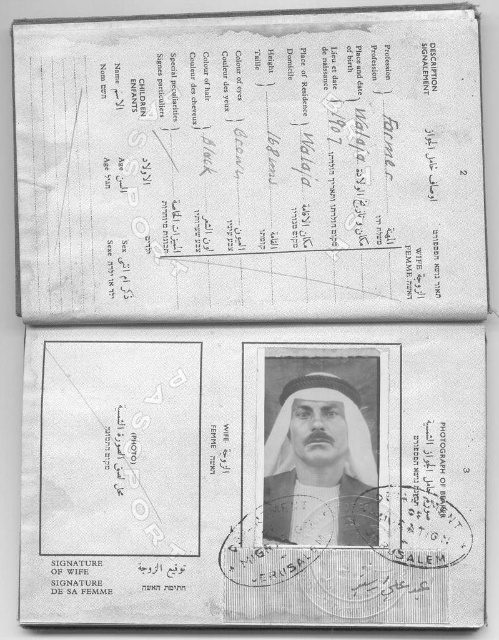
You are looking at the second and third pages of an open passport. You see a white paper receipt at upper center and a black paper at lower right. Which one is located more to the left?

The white paper receipt at upper center is more to the left than the black paper at lower right.

You are a border control officer examining the passport. You notice a black paper at lower right on page 2. Where exactly is this black paper located on the page?

The black paper at lower right is located at the 2D coordinates point (253,476) on the page.